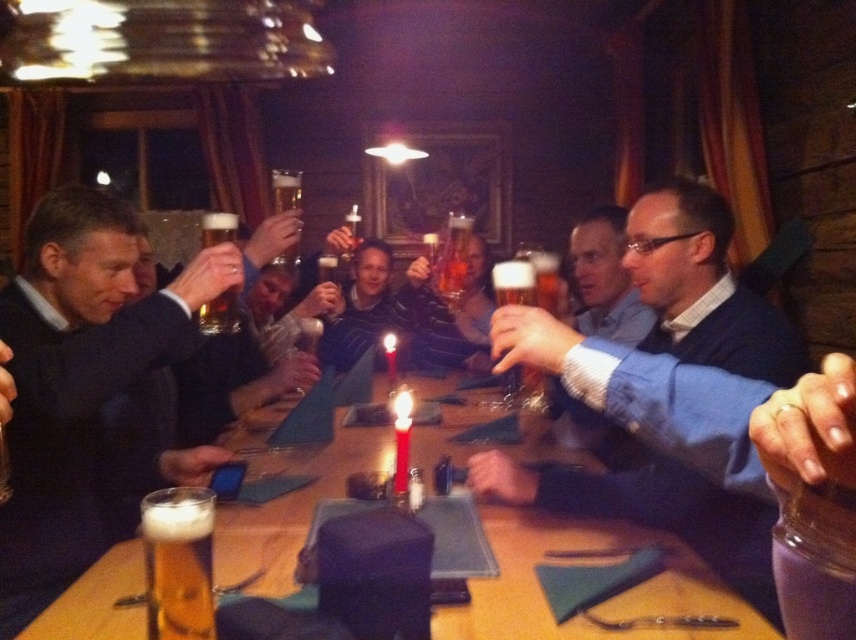
Question: Considering the real-world distances, which object is farthest from the white wax candle at center?

Choices:
 (A) foamy golden beer at center
 (B) matte blue shirt at center
 (C) matte black suit at left
 (D) translucent glass beer at center

Answer: (B)

Question: Which is farther from the wooden table at center?

Choices:
 (A) matte blue shirt at center
 (B) translucent glass beer at center
 (C) red wax candle at center

Answer: (C)

Question: Does matte blue shirt at center have a larger size compared to golden frothy beer at lower left?

Choices:
 (A) yes
 (B) no

Answer: (A)

Question: Among these objects, which one is farthest from the camera?

Choices:
 (A) matte black suit at left
 (B) white wax candle at center
 (C) golden frothy beer at lower left

Answer: (B)

Question: Observing the image, what is the correct spatial positioning of matte black suit at left in reference to translucent glass beer at center?

Choices:
 (A) right
 (B) left

Answer: (B)

Question: Does golden frothy beer at lower left appear on the left side of white wax candle at center?

Choices:
 (A) yes
 (B) no

Answer: (A)